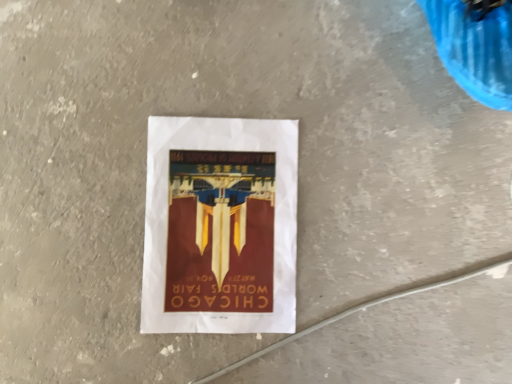
What do you see at coordinates (220, 226) in the screenshot? I see `matte paper poster at center` at bounding box center [220, 226].

Where is `matte paper poster at center`? matte paper poster at center is located at coordinates (220, 226).

Where is `matte paper poster at center`? The width and height of the screenshot is (512, 384). matte paper poster at center is located at coordinates (220, 226).